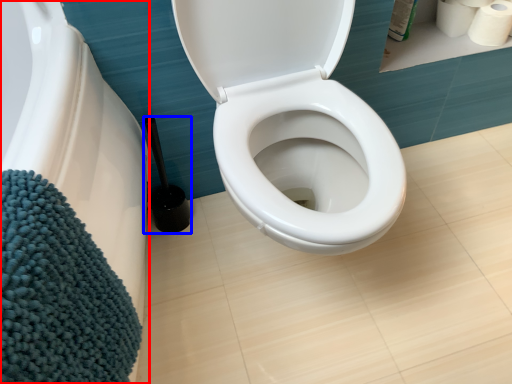
Question: Which object is further to the camera taking this photo, bath (highlighted by a red box) or brush (highlighted by a blue box)?

Choices:
 (A) bath
 (B) brush

Answer: (B)